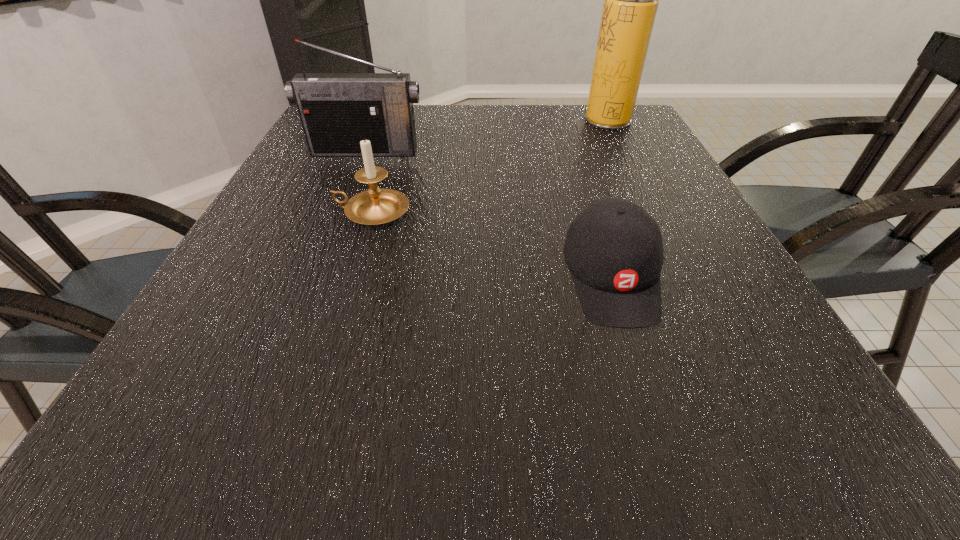
Locate an element on the screen. the farthest object is located at coordinates (631, 0).

Where is `aerosol can`? The width and height of the screenshot is (960, 540). aerosol can is located at coordinates (631, 0).

This screenshot has height=540, width=960. Find the location of `radio receiver`. radio receiver is located at coordinates (337, 110).

Locate an element on the screen. The image size is (960, 540). the second farthest object is located at coordinates (337, 110).

What are the coordinates of `the third farthest object` in the screenshot? It's located at (375, 206).

Identify the location of candle holder. Image resolution: width=960 pixels, height=540 pixels. (375, 206).

Where is `the nearest object`? This screenshot has height=540, width=960. the nearest object is located at coordinates (613, 248).

At what (x,y) coordinates should I click in order to perform the action: click on the shortest object. Please return your answer as a coordinate pair (x, y). The height and width of the screenshot is (540, 960). Looking at the image, I should click on (613, 248).

Where is `vacant point located on the left of the aerosol can`? vacant point located on the left of the aerosol can is located at coordinates (483, 119).

In order to click on vacant space located 0.250m on the front-facing side of the second farthest object in this screenshot , I will do `click(339, 217)`.